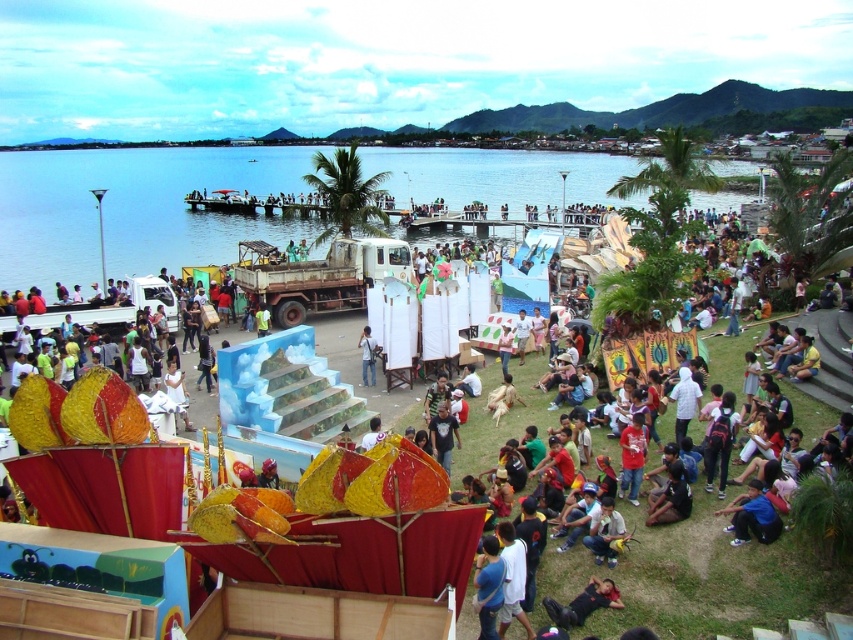
Question: Can you confirm if blue water at center is positioned above light blue fabric at center?

Choices:
 (A) no
 (B) yes

Answer: (B)

Question: Does black fabric person at lower center lie in front of light blue fabric at center?

Choices:
 (A) no
 (B) yes

Answer: (B)

Question: In this image, where is blue water at center located relative to black fabric person at lower center?

Choices:
 (A) right
 (B) left

Answer: (B)

Question: Which point is closer to the camera?

Choices:
 (A) light blue fabric at center
 (B) blue water at center
 (C) black fabric person at lower center

Answer: (C)

Question: Which is farther from the black fabric person at lower center?

Choices:
 (A) blue water at center
 (B) light blue fabric at center

Answer: (A)

Question: Among these objects, which one is farthest from the camera?

Choices:
 (A) blue water at center
 (B) black fabric person at lower center

Answer: (A)